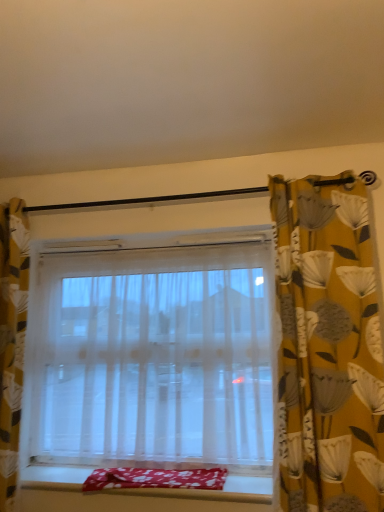
Question: From the image's perspective, is yellow floral fabric curtain at right, the first curtain in the right-to-left sequence, above or below transparent fabric window at center?

Choices:
 (A) below
 (B) above

Answer: (B)

Question: In terms of width, does yellow floral fabric curtain at right, the 2th curtain when ordered from left to right, look wider or thinner when compared to transparent fabric window at center?

Choices:
 (A) wide
 (B) thin

Answer: (B)

Question: Estimate the real-world distances between objects in this image. Which object is closer to the yellow floral fabric curtain at right, the first curtain in the right-to-left sequence?

Choices:
 (A) floral cotton blanket at lower center
 (B) transparent fabric window at center
 (C) yellow floral fabric curtain at left, marked as the second curtain in a right-to-left arrangement
 (D) smooth fabric window sill at lower center

Answer: (B)

Question: Which object is positioned farthest from the yellow floral fabric curtain at right, the first curtain in the right-to-left sequence?

Choices:
 (A) floral cotton blanket at lower center
 (B) smooth fabric window sill at lower center
 (C) yellow floral fabric curtain at left, marked as the second curtain in a right-to-left arrangement
 (D) transparent fabric window at center

Answer: (C)